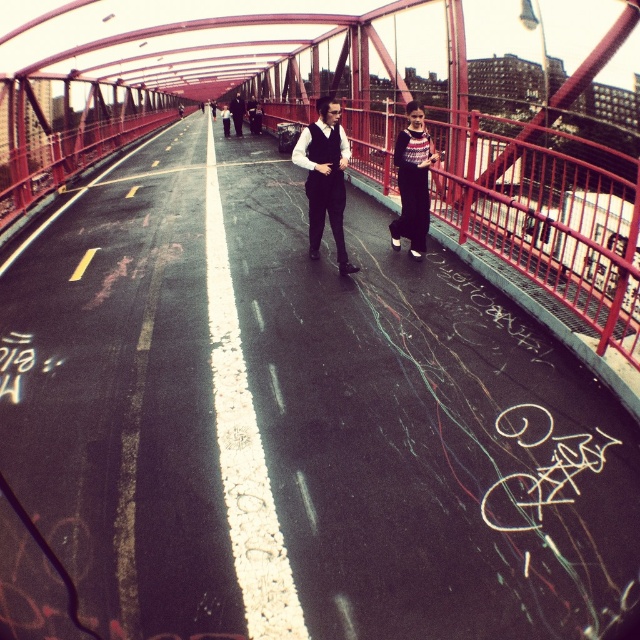
Question: Which point is closer to the camera taking this photo?

Choices:
 (A) tap(337, 236)
 (B) tap(241, 122)

Answer: (A)

Question: In this image, where is matte black vest at center located relative to knitted sweater at center?

Choices:
 (A) below
 (B) above

Answer: (B)

Question: Is knitted sweater at center smaller than dark gray suit at center?

Choices:
 (A) no
 (B) yes

Answer: (B)

Question: Which point is farther from the camera taking this photo?

Choices:
 (A) (404, 131)
 (B) (234, 109)
 (C) (328, 192)

Answer: (B)

Question: Which object is closer to the camera taking this photo?

Choices:
 (A) dark gray suit at center
 (B) matte black vest at center

Answer: (B)

Question: Is matte black vest at center wider than dark gray suit at center?

Choices:
 (A) yes
 (B) no

Answer: (B)